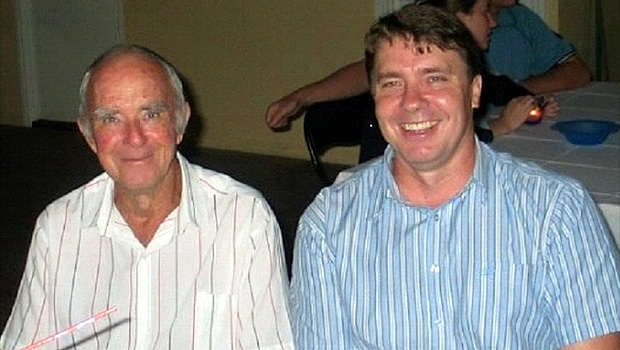
Locate an element on the screen. door is located at coordinates (86, 39).